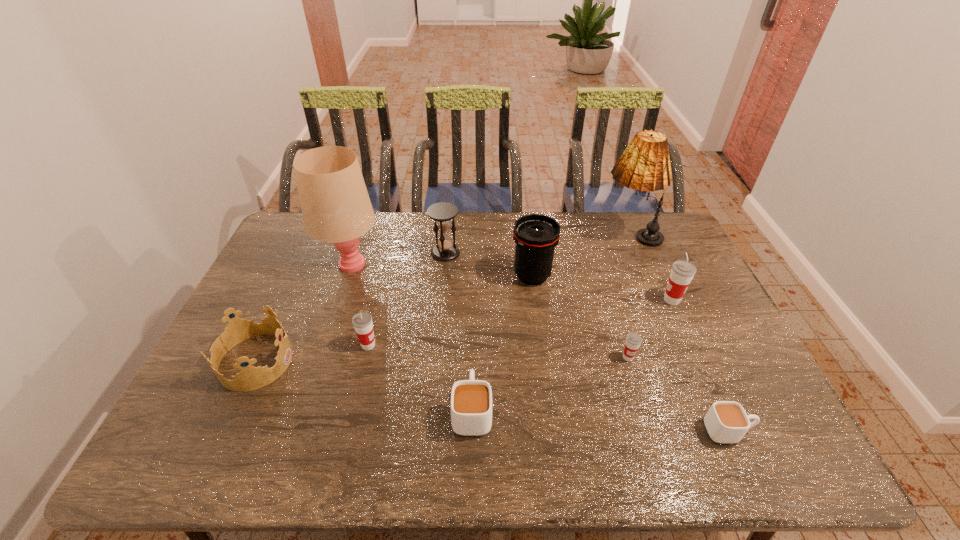
I want to click on free space located 0.350m on the front of the sixth object from left to right, so click(546, 386).

You are a GUI agent. You are given a task and a screenshot of the screen. Output one action in this format:
    pyautogui.click(x=<x>, y=<y>)
    Task: Click on the free region located 0.290m on the side of the rightmost red cup with the logo
    
    Given the screenshot: What is the action you would take?
    pyautogui.click(x=566, y=300)

Image resolution: width=960 pixels, height=540 pixels. Find the location of `vacant point located 0.330m on the side of the rightmost red cup with the logo`. vacant point located 0.330m on the side of the rightmost red cup with the logo is located at coordinates (553, 300).

The image size is (960, 540). Find the location of `vacant space located on the side of the rightmost red cup with the logo`. vacant space located on the side of the rightmost red cup with the logo is located at coordinates (644, 300).

Locate an element on the screen. This screenshot has width=960, height=540. vacant region located on the front of the seventh object from right to left is located at coordinates (442, 298).

You are a GUI agent. You are given a task and a screenshot of the screen. Output one action in this format:
    pyautogui.click(x=<x>, y=<y>)
    Task: Click on the vacant region located on the side of the second tallest cup with the logo
    The image size is (960, 540).
    Given the screenshot: What is the action you would take?
    pyautogui.click(x=493, y=345)

The image size is (960, 540). What are the coordinates of `vacant area located 0.370m on the front-facing side of the tiara` in the screenshot? It's located at (429, 361).

Locate an element on the screen. The image size is (960, 540). free location located on the side of the second red cup from left to right with the logo is located at coordinates (650, 429).

Image resolution: width=960 pixels, height=540 pixels. I want to click on free space located on the side with the handle of the sixth object from right to left, so click(x=472, y=366).

Where is `vacant space situated 0.300m on the side with the handle of the sixth object from right to left`? The width and height of the screenshot is (960, 540). vacant space situated 0.300m on the side with the handle of the sixth object from right to left is located at coordinates pyautogui.click(x=473, y=302).